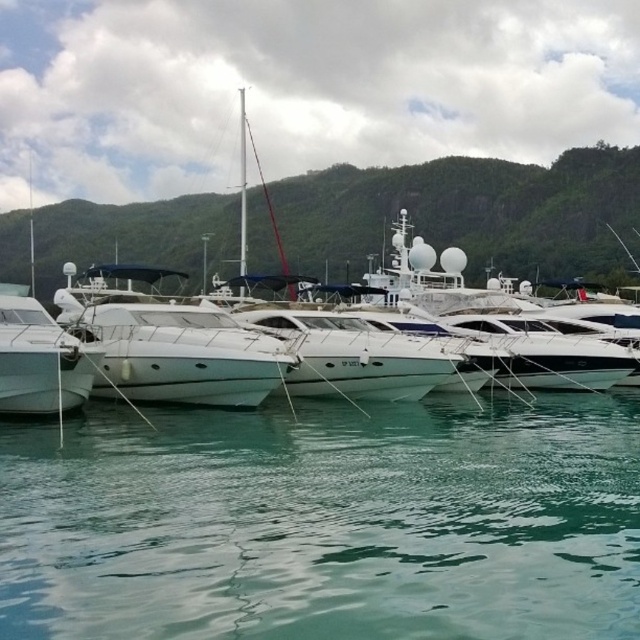
Question: Does green liquid water at lower center have a smaller size compared to white glossy boat at left?

Choices:
 (A) yes
 (B) no

Answer: (B)

Question: Which object is positioned closest to the white glossy boat at center?

Choices:
 (A) green liquid water at lower center
 (B) white glossy boat at left

Answer: (B)

Question: Which object appears farthest from the camera in this image?

Choices:
 (A) white glossy boat at left
 (B) white glossy boat at center
 (C) green liquid water at lower center

Answer: (B)

Question: Is green liquid water at lower center bigger than white glossy boat at center?

Choices:
 (A) no
 (B) yes

Answer: (A)

Question: Based on their relative distances, which object is farther from the green liquid water at lower center?

Choices:
 (A) white glossy boat at center
 (B) white glossy boat at left

Answer: (A)

Question: Does green liquid water at lower center appear on the left side of white glossy boat at center?

Choices:
 (A) no
 (B) yes

Answer: (A)